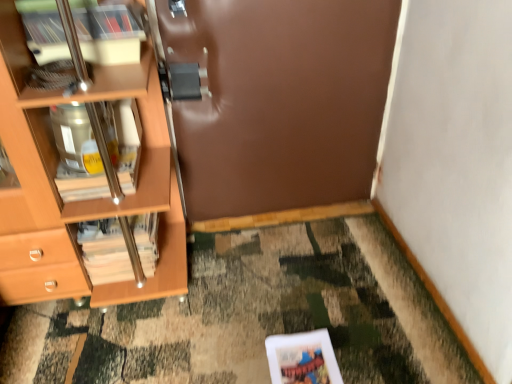
At what (x,y) coordinates should I click in order to perform the action: click on free spot in front of brown matte door at center. Please return your answer as a coordinate pair (x, y). The width and height of the screenshot is (512, 384). Looking at the image, I should click on (292, 288).